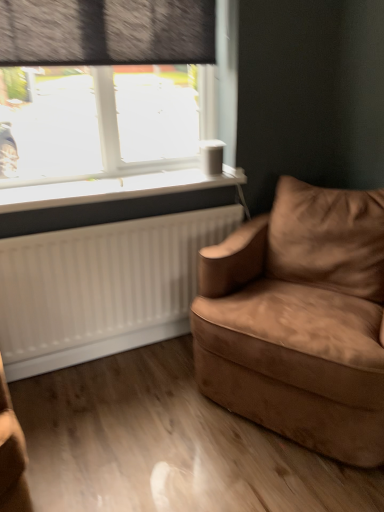
Question: Considering the relative sizes of transparent glass window at upper left and suede brown armchair at right in the image provided, is transparent glass window at upper left bigger than suede brown armchair at right?

Choices:
 (A) yes
 (B) no

Answer: (B)

Question: Is transparent glass window at upper left wider than suede brown armchair at right?

Choices:
 (A) no
 (B) yes

Answer: (A)

Question: Can you confirm if transparent glass window at upper left is positioned to the left of suede brown armchair at right?

Choices:
 (A) no
 (B) yes

Answer: (B)

Question: Can you confirm if transparent glass window at upper left is shorter than suede brown armchair at right?

Choices:
 (A) no
 (B) yes

Answer: (B)

Question: Considering the relative sizes of transparent glass window at upper left and suede brown armchair at right in the image provided, is transparent glass window at upper left smaller than suede brown armchair at right?

Choices:
 (A) yes
 (B) no

Answer: (A)

Question: Can you confirm if transparent glass window at upper left is thinner than suede brown armchair at right?

Choices:
 (A) no
 (B) yes

Answer: (B)

Question: Would you say transparent glass window at upper left is part of suede brown armchair at right's contents?

Choices:
 (A) yes
 (B) no

Answer: (B)

Question: Does suede brown armchair at right have a lesser width compared to transparent glass window at upper left?

Choices:
 (A) yes
 (B) no

Answer: (B)

Question: Does suede brown armchair at right have a smaller size compared to transparent glass window at upper left?

Choices:
 (A) no
 (B) yes

Answer: (A)

Question: Is suede brown armchair at right aimed at transparent glass window at upper left?

Choices:
 (A) no
 (B) yes

Answer: (A)

Question: Can you confirm if suede brown armchair at right is positioned to the right of transparent glass window at upper left?

Choices:
 (A) no
 (B) yes

Answer: (B)

Question: From a real-world perspective, is suede brown armchair at right positioned over transparent glass window at upper left based on gravity?

Choices:
 (A) yes
 (B) no

Answer: (B)

Question: Is dark gray textured curtain at upper left wider than white plastic window sill at upper left?

Choices:
 (A) no
 (B) yes

Answer: (A)